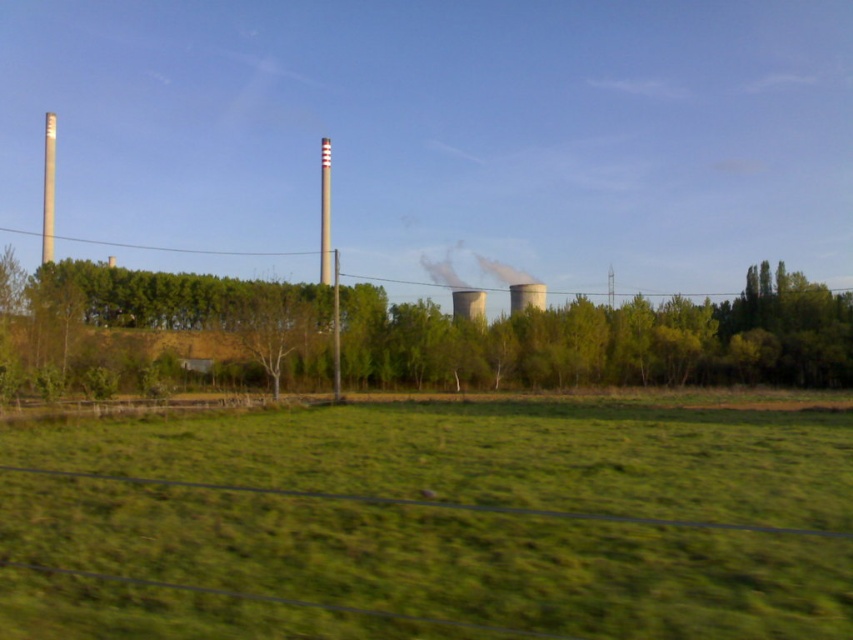
Can you confirm if green grass at center is taller than green leafy tree at center?

Incorrect, green grass at center's height is not larger of green leafy tree at center's.

Is point (67, 508) positioned behind point (480, 387)?

No, it is not.

Does point (419, 426) lie behind point (767, 369)?

No, it is not.

What are the coordinates of `green grass at center` in the screenshot? It's located at (430, 524).

Describe the element at coordinates (602, 340) in the screenshot. I see `green leafy tree at center` at that location.

Does green leafy tree at center have a lesser width compared to smoketransparentsteam at center?

Incorrect, green leafy tree at center's width is not less than smoketransparentsteam at center's.

Between point (640, 326) and point (421, 262), which one is positioned behind?

The point (421, 262) is behind.

Find the location of a particular element. The image size is (853, 640). green leafy tree at center is located at coordinates [602, 340].

Is green grass at center to the left of smooth white pole at center from the viewer's perspective?

In fact, green grass at center is to the right of smooth white pole at center.

Between point (604, 540) and point (328, 262), which one is positioned in front?

Point (604, 540) is more forward.

Locate an element on the screen. This screenshot has height=640, width=853. green grass at center is located at coordinates (430, 524).